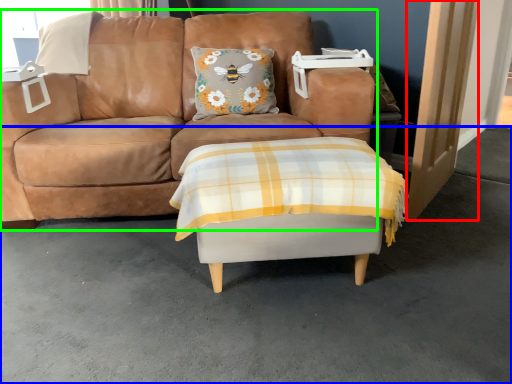
Question: Which object is positioned farthest from door (highlighted by a red box)? Select from concrete (highlighted by a blue box) and studio couch (highlighted by a green box).

Choices:
 (A) concrete
 (B) studio couch

Answer: (B)